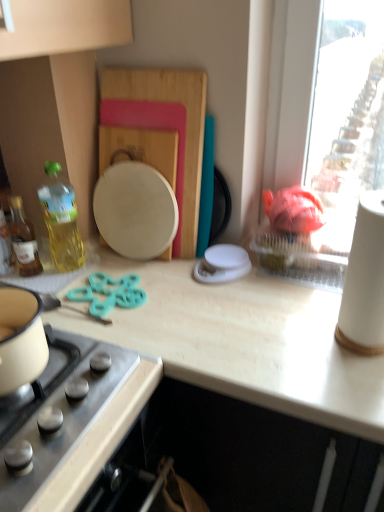
This screenshot has width=384, height=512. I want to click on free space in front of translucent yellow bottle at left, the 2th bottle viewed from the left, so click(x=84, y=301).